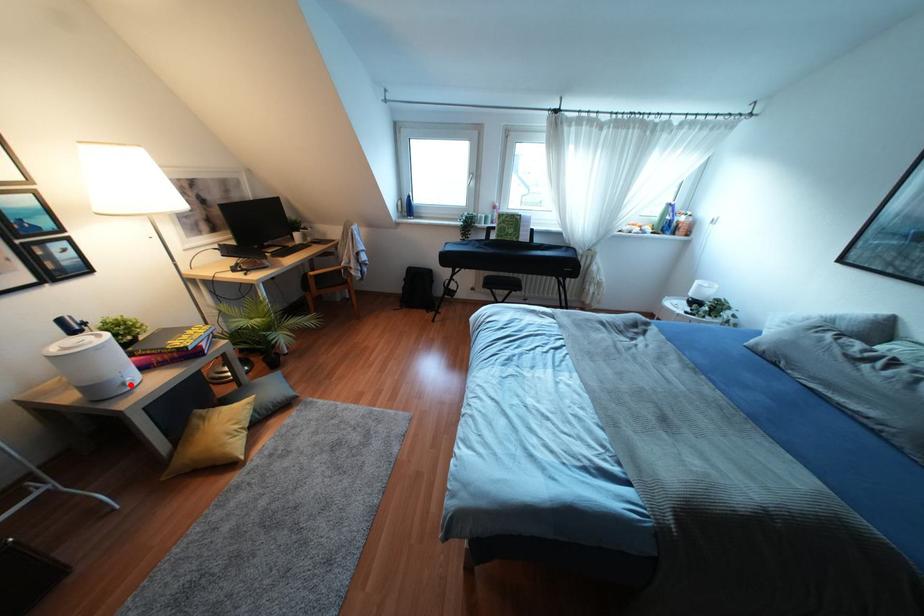
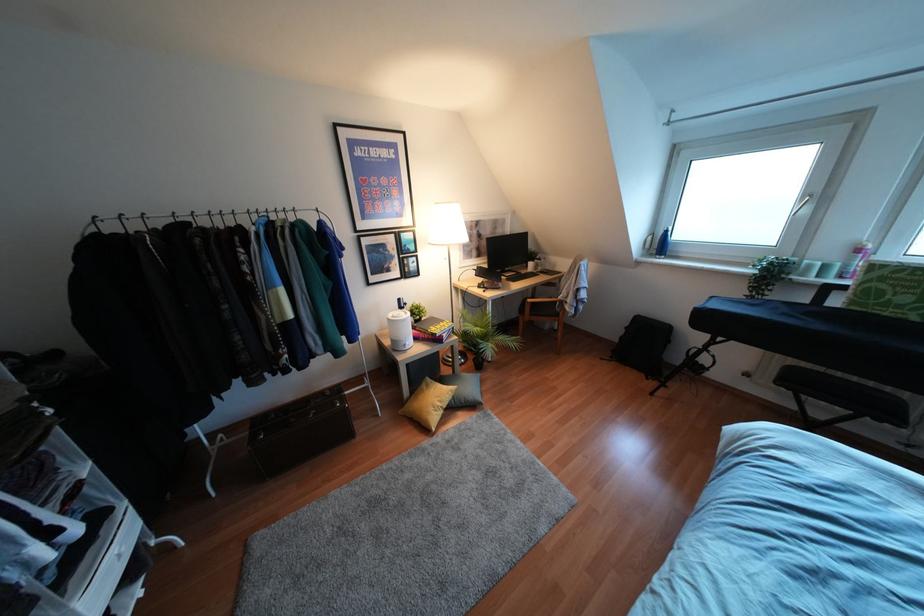
Find the pixel in the second image that matches the highlighted location in the first image.

(407, 347)